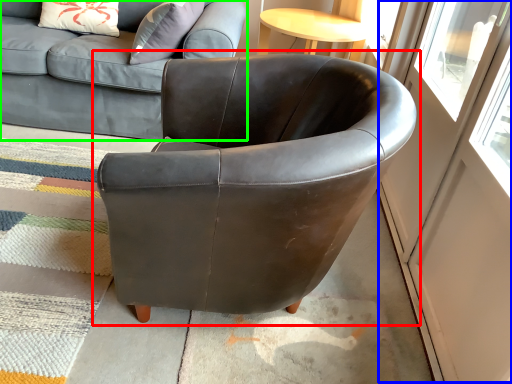
Question: Considering the real-world distances, which object is closest to chair (highlighted by a red box)? screen door (highlighted by a blue box) or studio couch (highlighted by a green box).

Choices:
 (A) screen door
 (B) studio couch

Answer: (A)